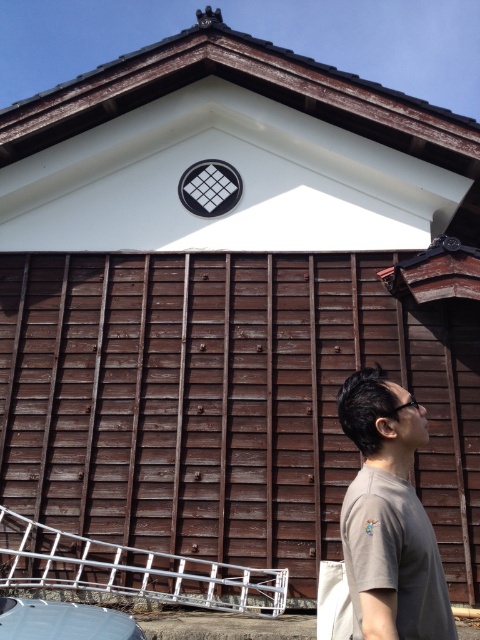
Is brown matte t-shirt at lower right taller than metallic silver car at lower left?

Indeed, brown matte t-shirt at lower right has a greater height compared to metallic silver car at lower left.

Between point (394, 636) and point (36, 632), which one is positioned behind?

Point (36, 632)

The width and height of the screenshot is (480, 640). In order to click on brown matte t-shirt at lower right in this screenshot , I will do `click(388, 516)`.